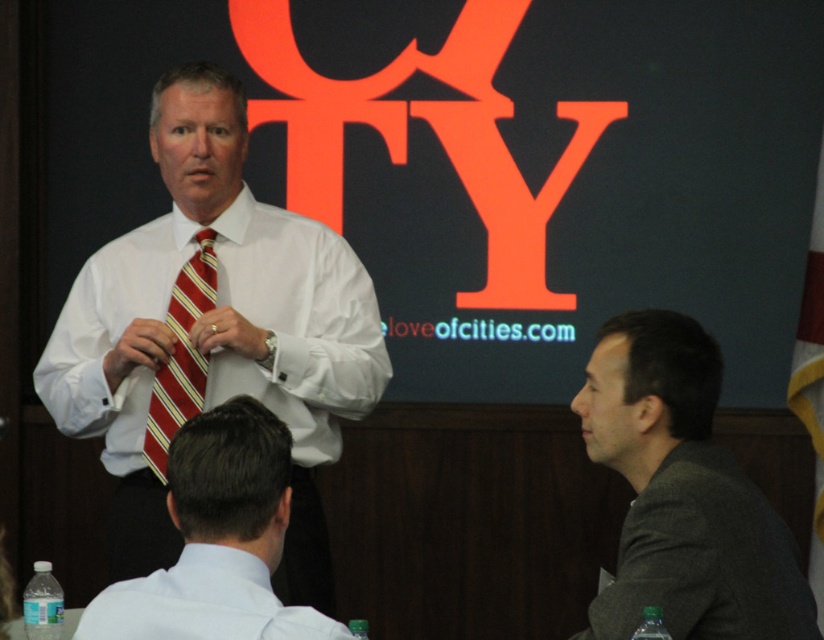
Question: Which of the following is the closest to the observer?

Choices:
 (A) (721, 522)
 (B) (171, 589)

Answer: (B)

Question: Which of the following is the closest to the observer?

Choices:
 (A) matte orange projection screen at upper center
 (B) white smooth shirt at center
 (C) white shirt at center
 (D) dark gray suit at right

Answer: (C)

Question: Is matte orange projection screen at upper center in front of dark gray suit at right?

Choices:
 (A) yes
 (B) no

Answer: (B)

Question: Does white smooth shirt at center lie behind red striped tie at center?

Choices:
 (A) yes
 (B) no

Answer: (B)

Question: Among these points, which one is nearest to the camera?

Choices:
 (A) (48, 368)
 (B) (197, 442)
 (C) (239, 604)
 (D) (181, 296)

Answer: (C)

Question: Does white shirt at center appear on the right side of red striped tie at center?

Choices:
 (A) no
 (B) yes

Answer: (B)